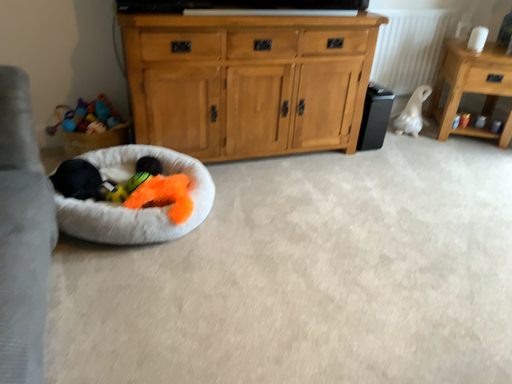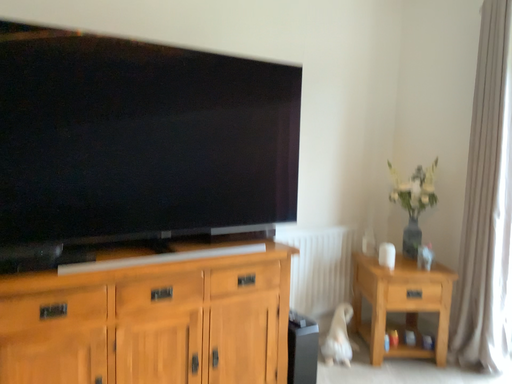
Question: How did the camera likely rotate when shooting the video?

Choices:
 (A) rotated upward
 (B) rotated downward

Answer: (A)